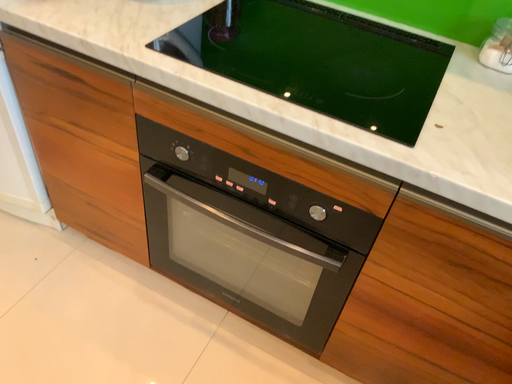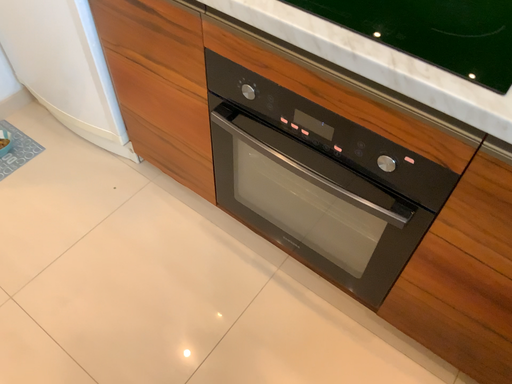
Question: How did the camera likely rotate when shooting the video?

Choices:
 (A) rotated downward
 (B) rotated upward

Answer: (A)